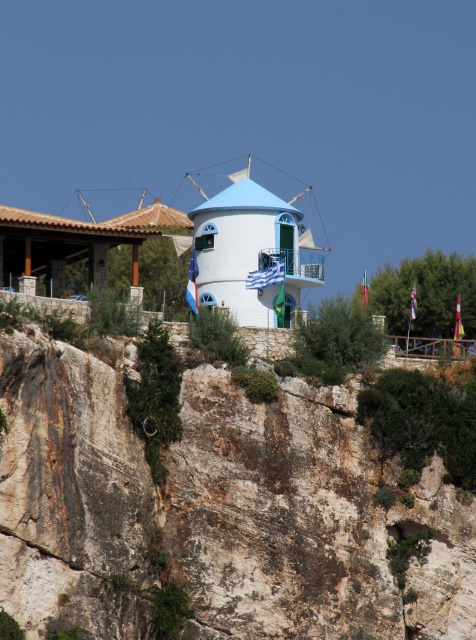
You are planning to build a small garden between the white stone cliff at center and the white matte windmill at center. Which structure should you place the garden closer to if you want it to be near the larger structure?

You should place the garden closer to the white matte windmill at center because the white stone cliff at center is smaller in size compared to it.

You are standing at the base of the cliff and want to take a photo of the point at coordinates point [453,497]. Given that your camera has a maximum focus range of 100 meters, will you be able to focus on the point?

The point at coordinates point [453,497] is 95.63 meters away from you. Since your camera can focus up to 100 meters, you will be able to focus on the point.

You are standing at the base of the cliff and want to take a photo of the white stone cliff at center and the white matte windmill at center. Which one will appear larger in your photo?

The white stone cliff at center will appear larger in your photo because it is closer to you than the white matte windmill at center, which is behind it.